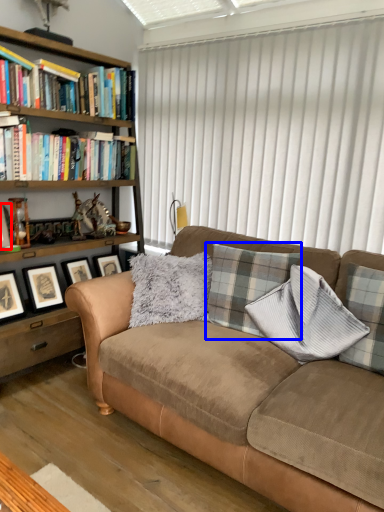
Question: Which point is further to the camera, picture frame (highlighted by a red box) or plaid (highlighted by a blue box)?

Choices:
 (A) picture frame
 (B) plaid

Answer: (A)